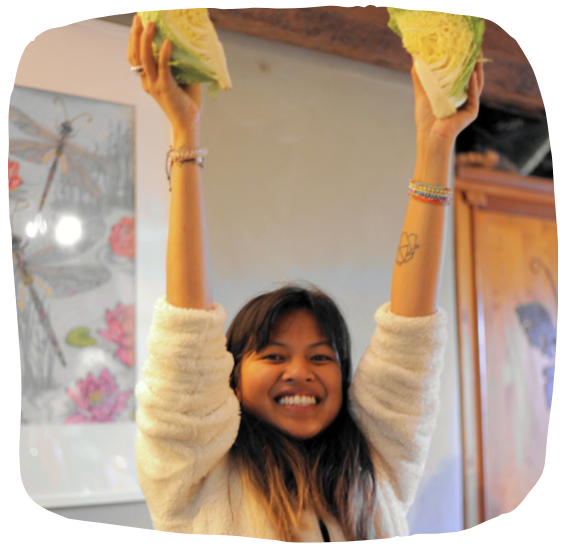
At what (x,y) coordinates should I click in order to perform the action: click on white wall. Please return your answer as a coordinate pair (x, y). The height and width of the screenshot is (546, 564). Looking at the image, I should click on [x=329, y=200].